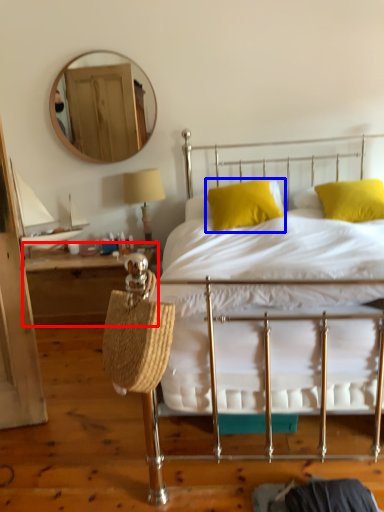
Question: Which of the following is the closest to the observer, nightstand (highlighted by a red box) or pillow (highlighted by a blue box)?

Choices:
 (A) nightstand
 (B) pillow

Answer: (B)